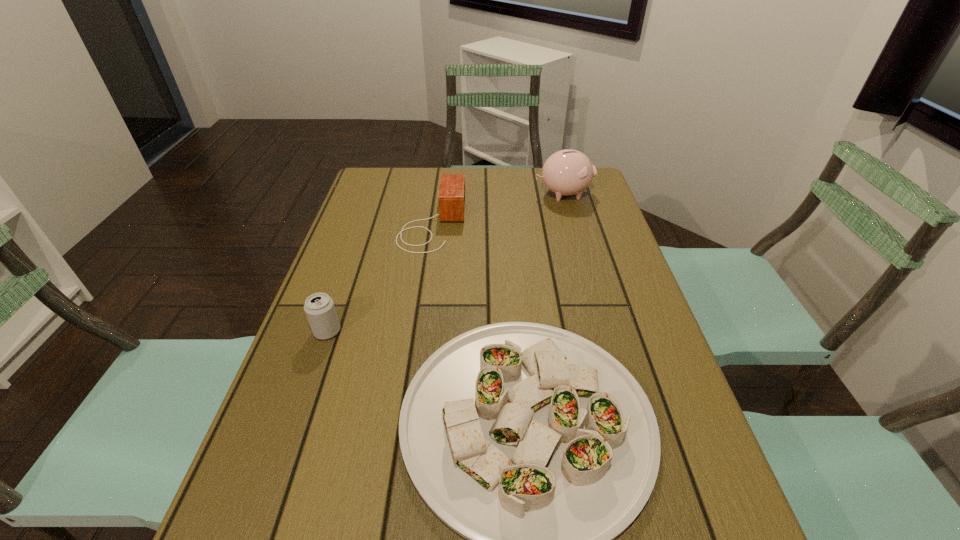
Where is `object that is at the right edge`? object that is at the right edge is located at coordinates (567, 172).

Find the location of a particular element. The image size is (960, 540). object that is at the far left corner is located at coordinates tap(451, 196).

The width and height of the screenshot is (960, 540). In order to click on object at the far right corner in this screenshot , I will do `click(567, 172)`.

Where is `free space at the far edge of the desktop`? The image size is (960, 540). free space at the far edge of the desktop is located at coordinates (539, 167).

The image size is (960, 540). Identify the location of free space at the left edge of the desktop. (279, 465).

I want to click on free spot at the right edge of the desktop, so click(602, 222).

Where is `vacant point located between the can and the radio receiver`? The height and width of the screenshot is (540, 960). vacant point located between the can and the radio receiver is located at coordinates (380, 278).

Identify the location of empty space between the tallest object and the radio receiver. The width and height of the screenshot is (960, 540). (497, 208).

Locate an element on the screen. free area in between the tallest object and the radio receiver is located at coordinates (497, 208).

Locate an element on the screen. The height and width of the screenshot is (540, 960). free space between the radio receiver and the leftmost object is located at coordinates 380,278.